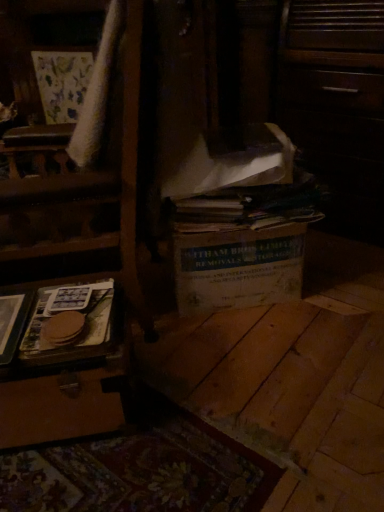
Question: Is wooden tray at left not near velvet-like beige armchair at upper left?

Choices:
 (A) yes
 (B) no

Answer: (A)

Question: From a real-world perspective, is wooden tray at left positioned under velvet-like beige armchair at upper left based on gravity?

Choices:
 (A) yes
 (B) no

Answer: (A)

Question: Is wooden tray at left taller than velvet-like beige armchair at upper left?

Choices:
 (A) yes
 (B) no

Answer: (B)

Question: Is wooden tray at left looking in the opposite direction of velvet-like beige armchair at upper left?

Choices:
 (A) no
 (B) yes

Answer: (A)

Question: From a real-world perspective, is wooden tray at left over velvet-like beige armchair at upper left?

Choices:
 (A) yes
 (B) no

Answer: (B)

Question: Does wooden tray at left have a lesser height compared to velvet-like beige armchair at upper left?

Choices:
 (A) no
 (B) yes

Answer: (B)

Question: Does velvet-like beige armchair at upper left lie in front of white cardboard box at center?

Choices:
 (A) no
 (B) yes

Answer: (A)

Question: Is velvet-like beige armchair at upper left oriented away from white cardboard box at center?

Choices:
 (A) no
 (B) yes

Answer: (A)

Question: Does velvet-like beige armchair at upper left appear on the right side of white cardboard box at center?

Choices:
 (A) yes
 (B) no

Answer: (B)

Question: Could you tell me if velvet-like beige armchair at upper left is facing white cardboard box at center?

Choices:
 (A) yes
 (B) no

Answer: (B)

Question: Is velvet-like beige armchair at upper left bigger than white cardboard box at center?

Choices:
 (A) yes
 (B) no

Answer: (A)

Question: Is velvet-like beige armchair at upper left shorter than white cardboard box at center?

Choices:
 (A) no
 (B) yes

Answer: (A)

Question: Does velvet-like beige armchair at upper left have a greater height compared to brown paper at lower left?

Choices:
 (A) no
 (B) yes

Answer: (B)